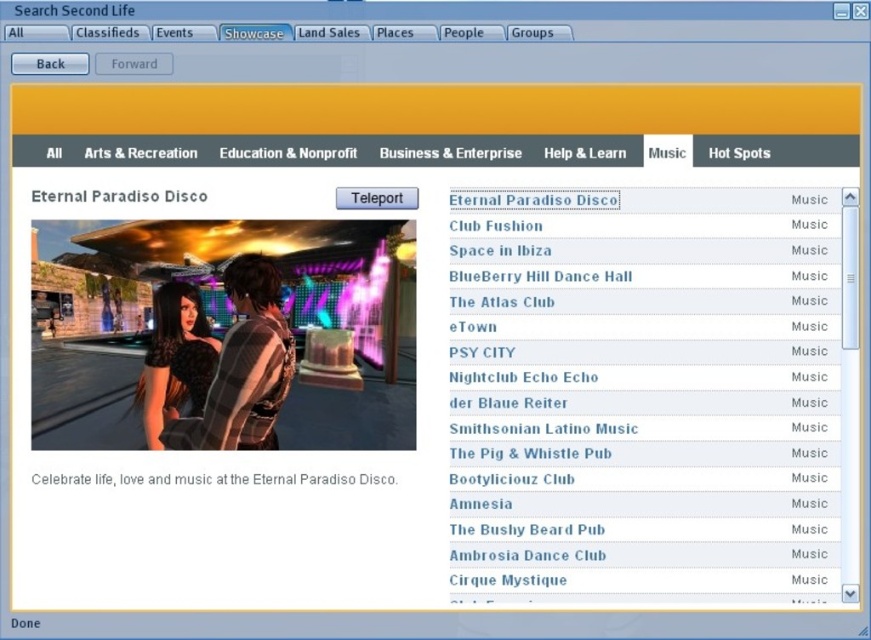
Is shiny black dress at center shorter than white text on black background at center?

In fact, shiny black dress at center may be taller than white text on black background at center.

Is shiny black dress at center to the left of white text on black background at center from the viewer's perspective?

Yes, shiny black dress at center is to the left of white text on black background at center.

Locate an element on the screen. This screenshot has height=640, width=871. shiny black dress at center is located at coordinates (220, 337).